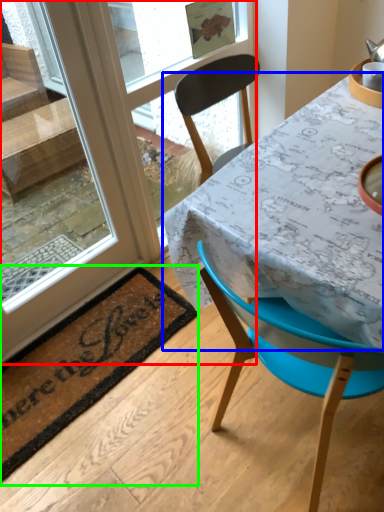
Question: Which is nearer to the window (highlighted by a red box)? table (highlighted by a blue box) or mat (highlighted by a green box).

Choices:
 (A) table
 (B) mat

Answer: (B)